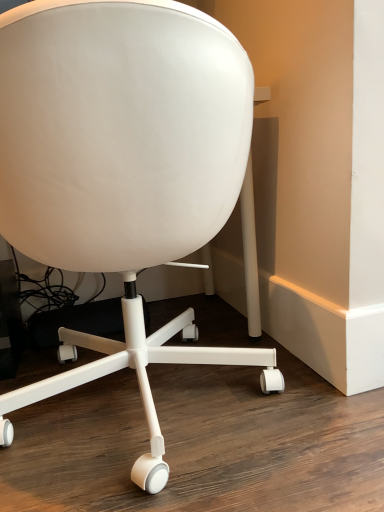
Locate an element on the screen. This screenshot has height=512, width=384. white matte office chair at center is located at coordinates (122, 170).

What do you see at coordinates (122, 170) in the screenshot? The height and width of the screenshot is (512, 384). I see `white matte office chair at center` at bounding box center [122, 170].

I want to click on white matte office chair at center, so click(x=122, y=170).